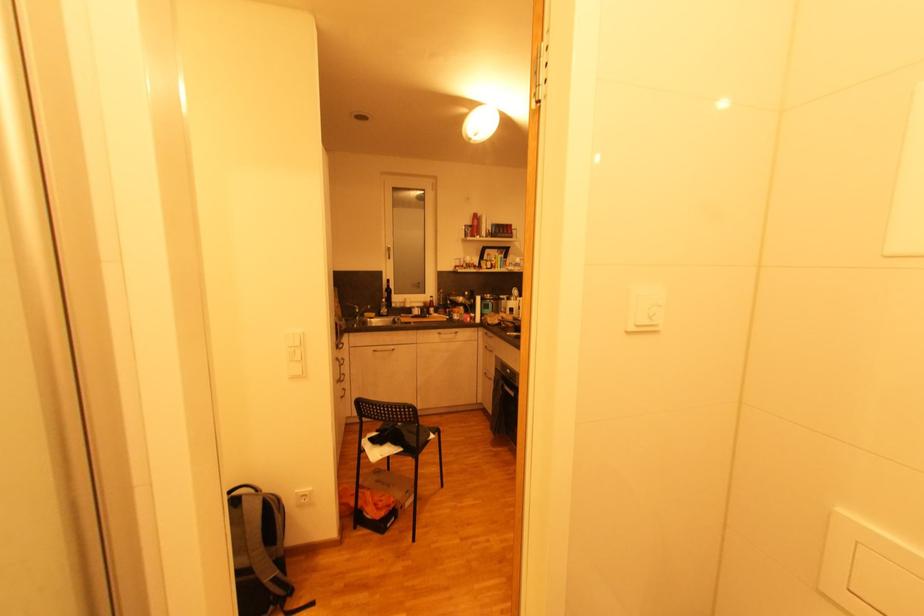
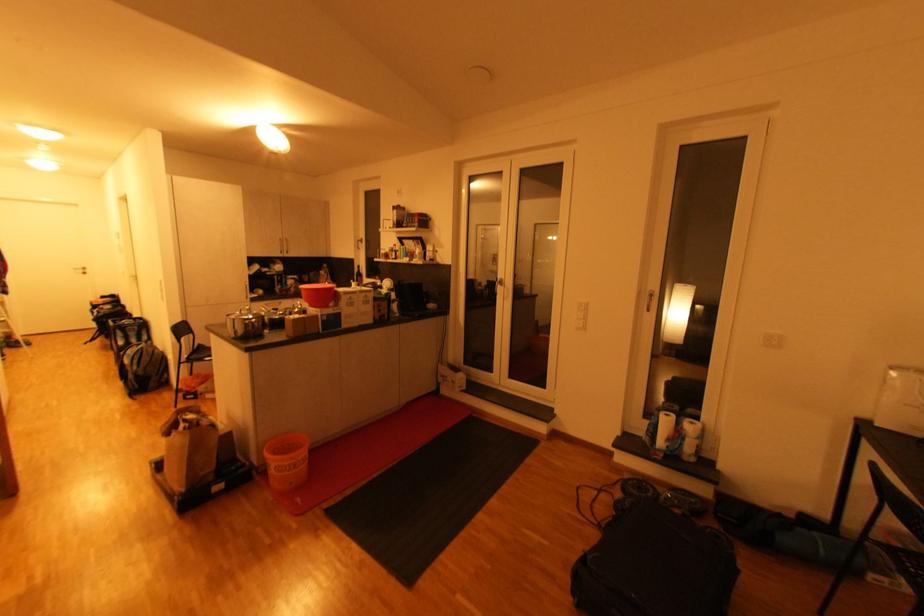
Locate, in the second image, the point that corresponds to the point at 391,291 in the first image.

(361, 275)